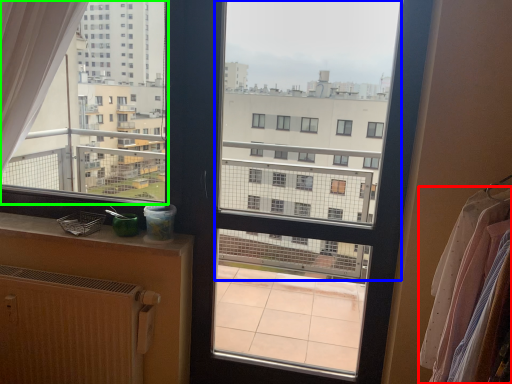
Question: Which is farther away from clothing (highlighted by a red box)? window screen (highlighted by a blue box) or condominium (highlighted by a green box)?

Choices:
 (A) window screen
 (B) condominium

Answer: (A)